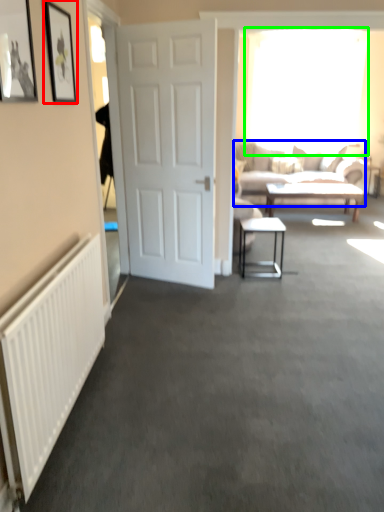
Question: Which is nearer to the picture frame (highlighted by a red box)? studio couch (highlighted by a blue box) or window (highlighted by a green box).

Choices:
 (A) studio couch
 (B) window

Answer: (A)